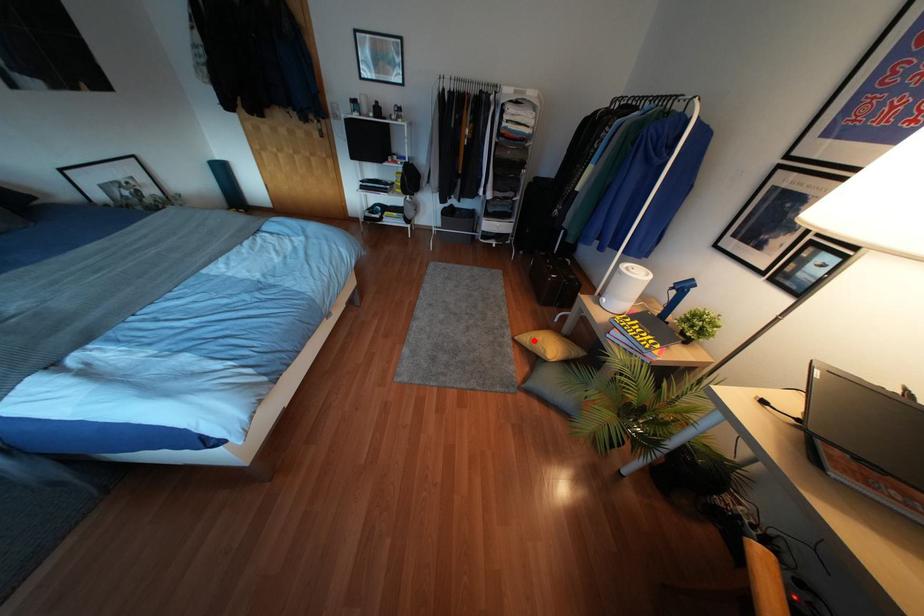
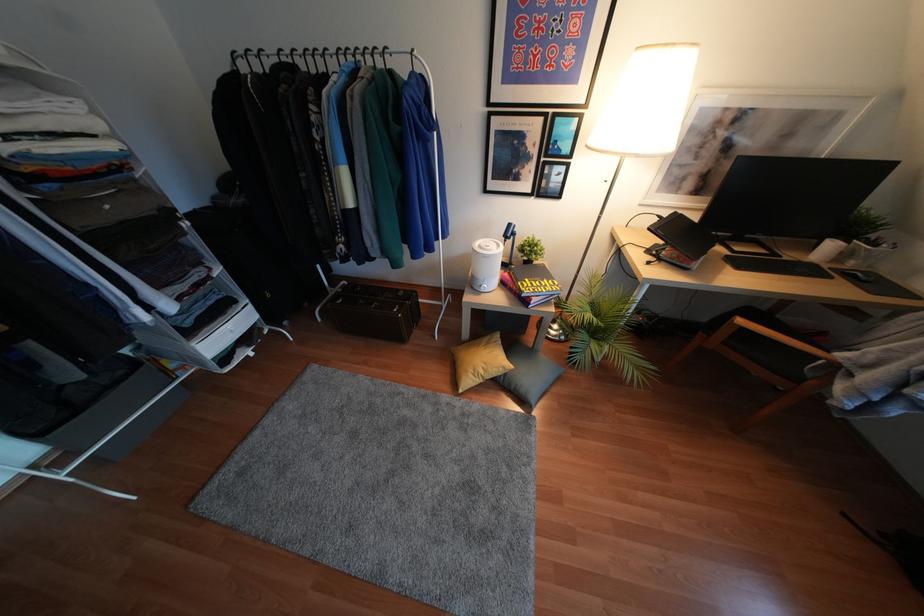
Question: I am providing you with two images of the same scene from different viewpoints. In image1, a red point is highlighted. Considering the same 3D point in image2, which of the following is correct?

Choices:
 (A) It is closer
 (B) It is farther

Answer: (B)